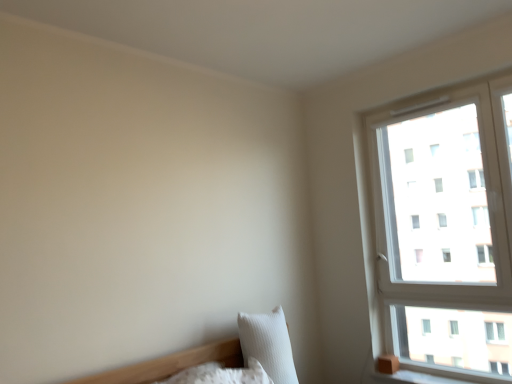
Locate an element on the screen. This screenshot has width=512, height=384. free spot above white soft pillow at lower left, arranged as the first pillow when viewed from the left (from a real-world perspective) is located at coordinates (183, 368).